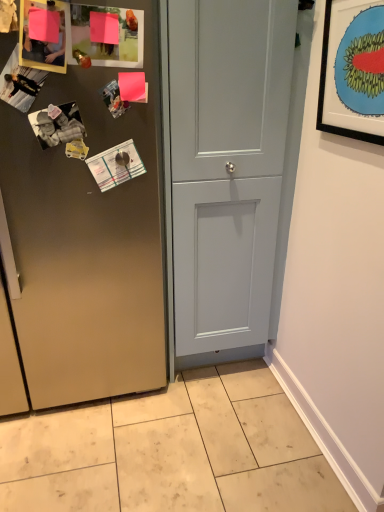
Question: Is light gray wood door at center, the second door from the left, to the left of black matte picture frame at upper right from the viewer's perspective?

Choices:
 (A) yes
 (B) no

Answer: (A)

Question: Is light gray wood door at center, the second door from the left, looking in the opposite direction of black matte picture frame at upper right?

Choices:
 (A) no
 (B) yes

Answer: (A)

Question: From a real-world perspective, is light gray wood door at center, the first door positioned from the right, on black matte picture frame at upper right?

Choices:
 (A) no
 (B) yes

Answer: (A)

Question: Is light gray wood door at center, the first door positioned from the right, oriented towards black matte picture frame at upper right?

Choices:
 (A) no
 (B) yes

Answer: (B)

Question: Can we say light gray wood door at center, the first door positioned from the right, lies outside black matte picture frame at upper right?

Choices:
 (A) yes
 (B) no

Answer: (A)

Question: Is point (188, 507) positioned closer to the camera than point (337, 128)?

Choices:
 (A) farther
 (B) closer

Answer: (A)

Question: Considering their positions, is beige tile at lower center located in front of or behind black matte picture frame at upper right?

Choices:
 (A) behind
 (B) front

Answer: (A)

Question: From a real-world perspective, is beige tile at lower center above or below black matte picture frame at upper right?

Choices:
 (A) below
 (B) above

Answer: (A)

Question: In terms of width, does beige tile at lower center look wider or thinner when compared to black matte picture frame at upper right?

Choices:
 (A) thin
 (B) wide

Answer: (B)

Question: Is point (259, 500) closer or farther from the camera than point (94, 274)?

Choices:
 (A) closer
 (B) farther

Answer: (A)

Question: From a real-world perspective, is beige tile at lower center above or below satin finish cabinet at center, the first door in the left-to-right sequence?

Choices:
 (A) above
 (B) below

Answer: (B)

Question: Based on their sizes in the image, would you say beige tile at lower center is bigger or smaller than satin finish cabinet at center, which is the 2th door in right-to-left order?

Choices:
 (A) big
 (B) small

Answer: (B)

Question: In the image, is beige tile at lower center on the left side or the right side of satin finish cabinet at center, the first door in the left-to-right sequence?

Choices:
 (A) left
 (B) right

Answer: (B)

Question: Relative to light gray wood door at center, the second door from the left, is satin finish cabinet at center, which is the 2th door in right-to-left order, in front or behind?

Choices:
 (A) front
 (B) behind

Answer: (A)

Question: Considering the positions of satin finish cabinet at center, the first door in the left-to-right sequence, and light gray wood door at center, the second door from the left, in the image, is satin finish cabinet at center, the first door in the left-to-right sequence, wider or thinner than light gray wood door at center, the second door from the left,?

Choices:
 (A) wide
 (B) thin

Answer: (A)